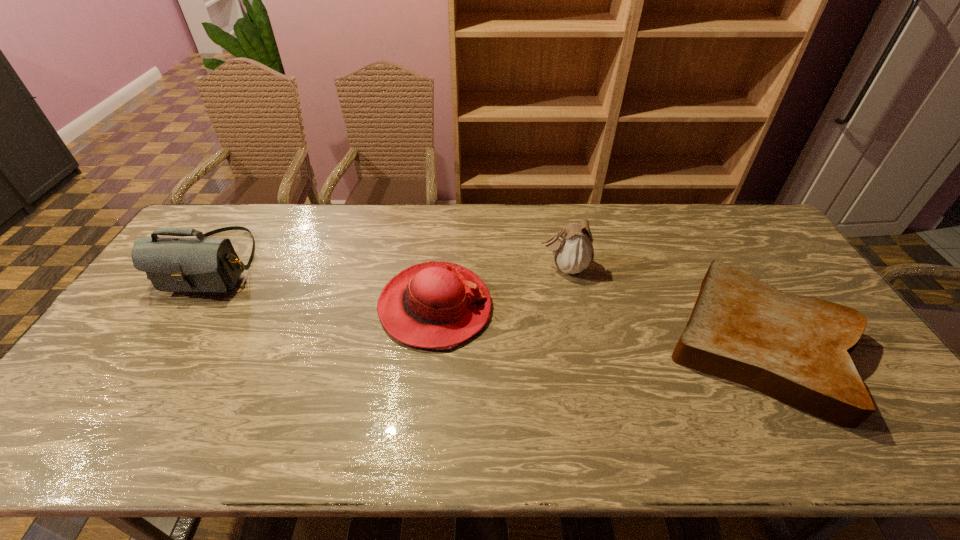
The height and width of the screenshot is (540, 960). What are the coordinates of `free space located on the front-facing side of the third object from left to right` in the screenshot? It's located at (420, 267).

Identify the location of vacant area situated 0.070m at the front of the hat with a bow. (516, 307).

You are a GUI agent. You are given a task and a screenshot of the screen. Output one action in this format:
    pyautogui.click(x=<x>, y=<y>)
    Task: Click on the free space located on the left of the rightmost object
    This screenshot has height=540, width=960.
    Given the screenshot: What is the action you would take?
    pyautogui.click(x=595, y=343)

What are the coordinates of `object located in the far edge section of the desktop` in the screenshot? It's located at (201, 264).

Where is `object at the near edge`? The image size is (960, 540). object at the near edge is located at coordinates (796, 349).

You are a GUI agent. You are given a task and a screenshot of the screen. Output one action in this format:
    pyautogui.click(x=<x>, y=<y>)
    Task: Click on the object that is at the left edge
    
    Given the screenshot: What is the action you would take?
    pyautogui.click(x=201, y=264)

The image size is (960, 540). In order to click on object present at the right edge in this screenshot , I will do `click(796, 349)`.

Where is `object at the far left corner`? This screenshot has width=960, height=540. object at the far left corner is located at coordinates (201, 264).

Identify the location of object that is at the near right corner. (796, 349).

Where is `vacant area at the far edge of the desktop`? vacant area at the far edge of the desktop is located at coordinates (429, 244).